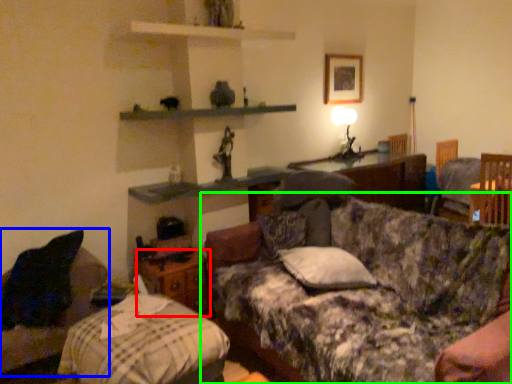
Question: Based on their relative distances, which object is nearer to nightstand (highlighted by a red box)? Choose from furniture (highlighted by a blue box) and studio couch (highlighted by a green box).

Choices:
 (A) furniture
 (B) studio couch

Answer: (A)